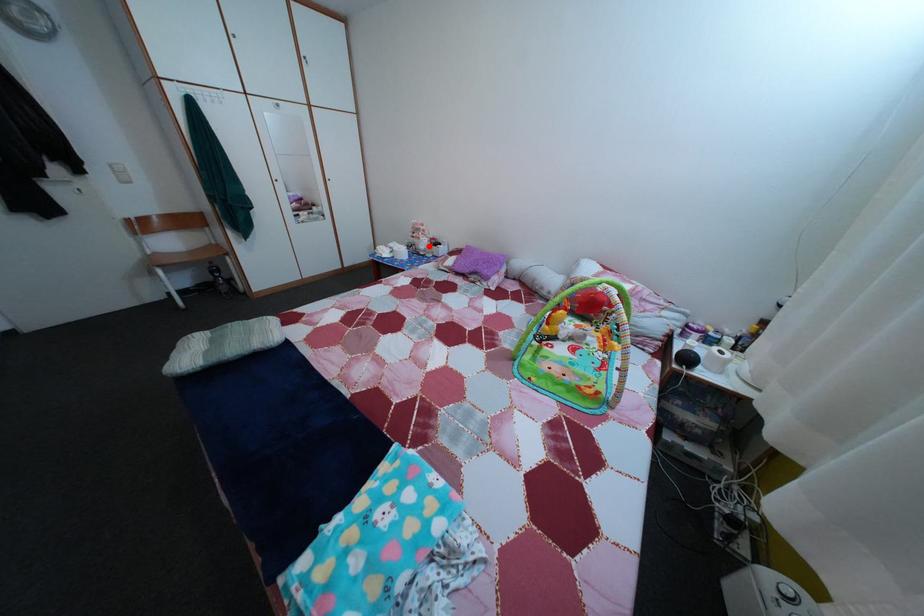
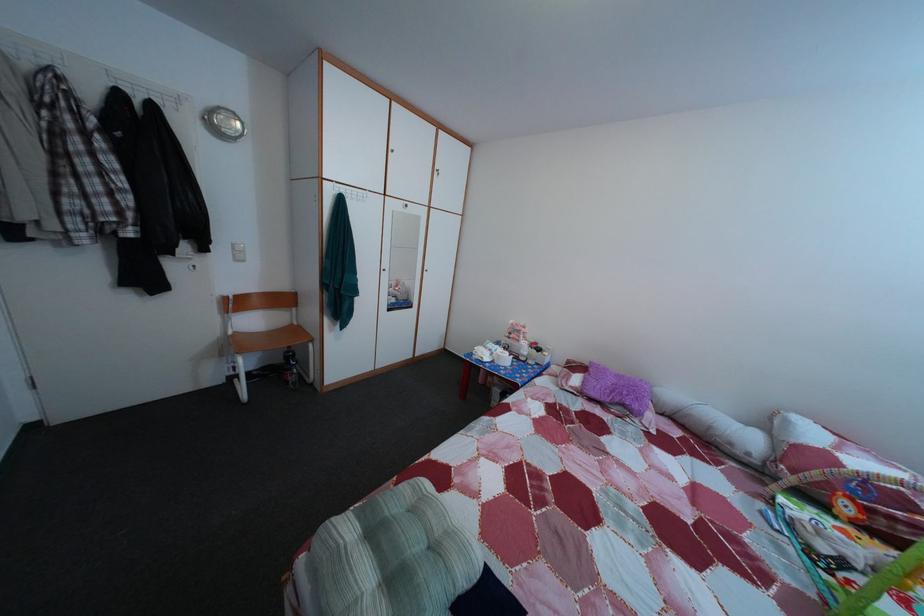
In the second image, find the point that corresponds to the highlighted location in the first image.

(528, 349)